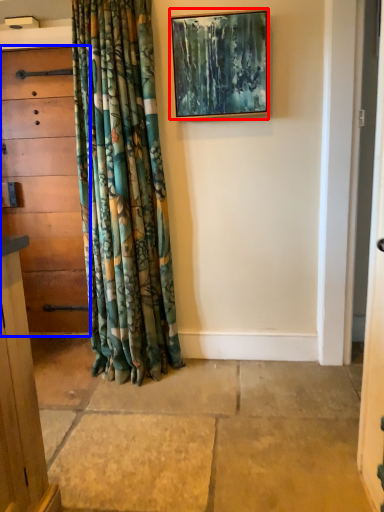
Question: Which object appears farthest to the camera in this image, picture frame (highlighted by a red box) or chest of drawers (highlighted by a blue box)?

Choices:
 (A) picture frame
 (B) chest of drawers

Answer: (B)